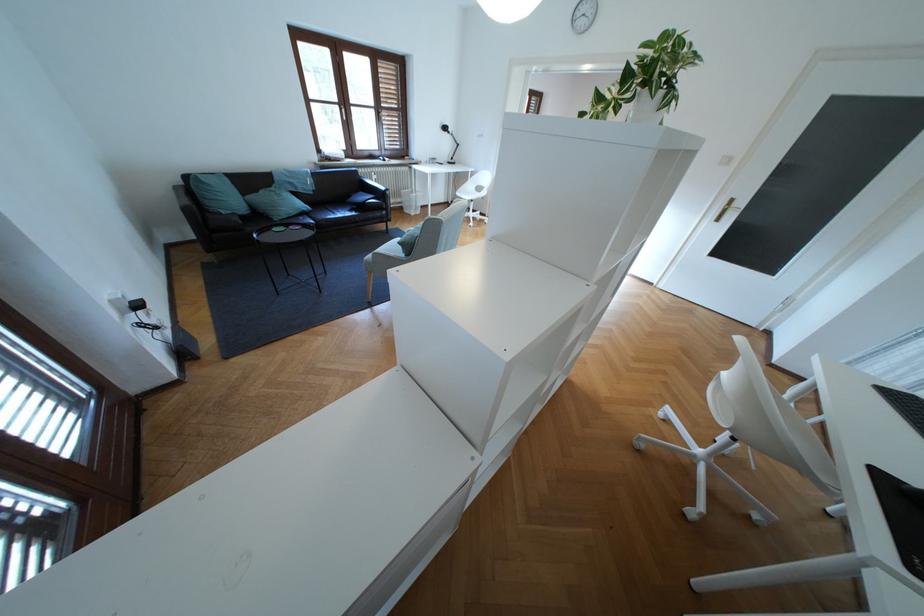
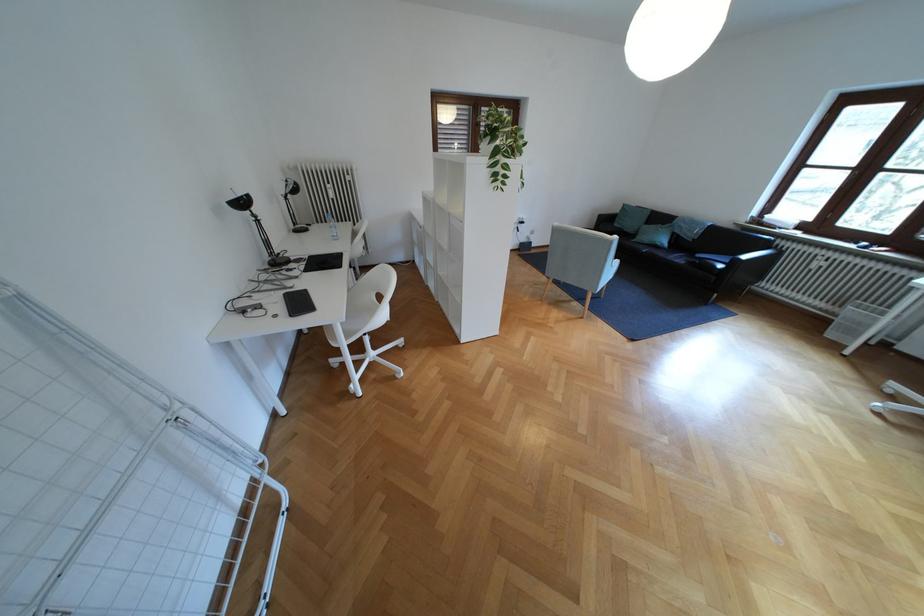
The point at (234, 213) is marked in the first image. Where is the corresponding point in the second image?

(626, 225)